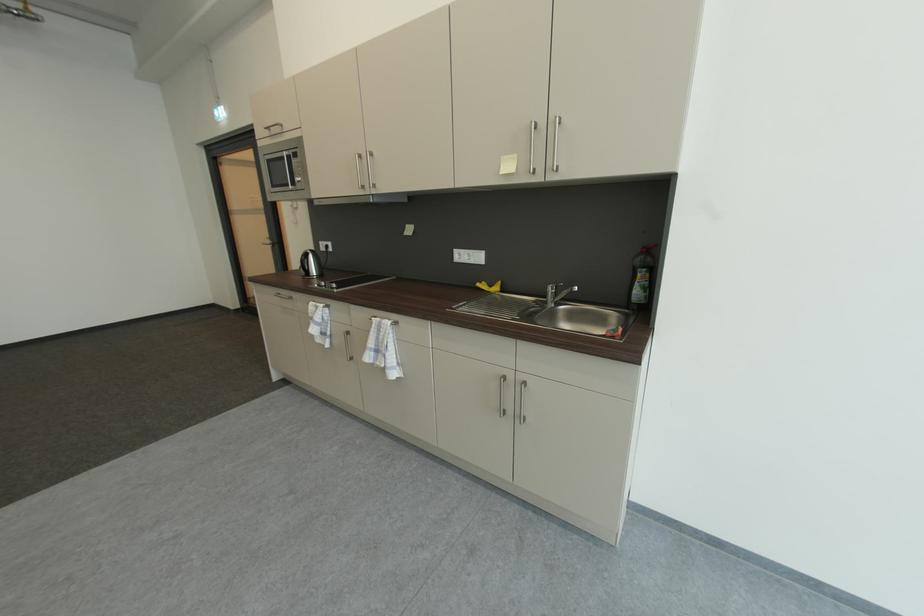
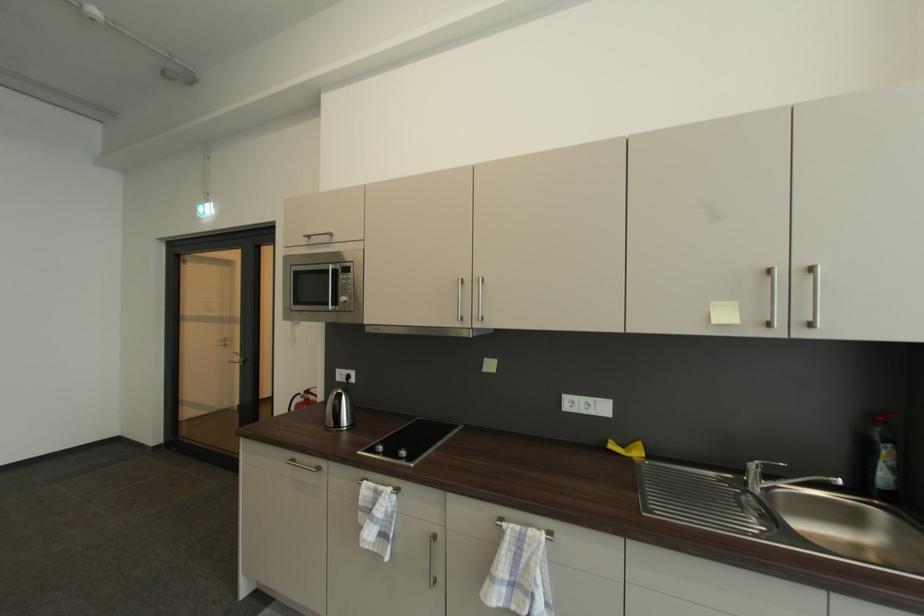
Locate, in the second image, the point that corresponds to the point at 290,158 in the first image.

(334, 272)